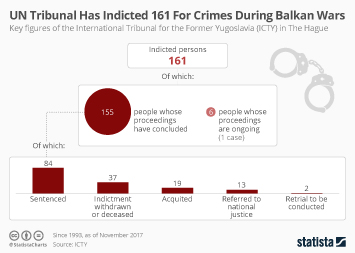
Where is `poster title`? poster title is located at coordinates (121, 15).